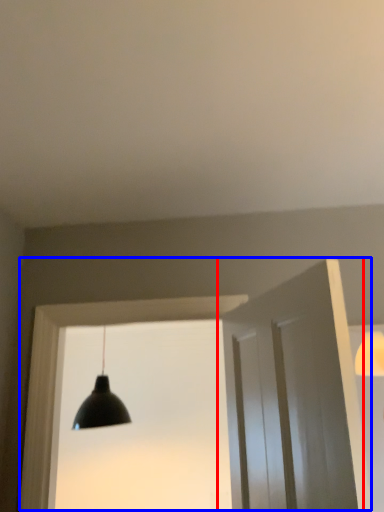
Question: Which point is closer to the camera, door (highlighted by a red box) or window frame (highlighted by a blue box)?

Choices:
 (A) door
 (B) window frame

Answer: (A)